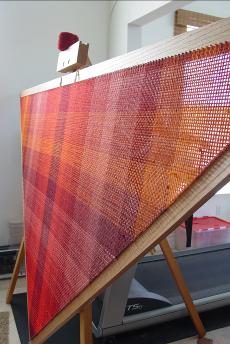
Where is `plaid woven fabric`? plaid woven fabric is located at coordinates (74, 134).